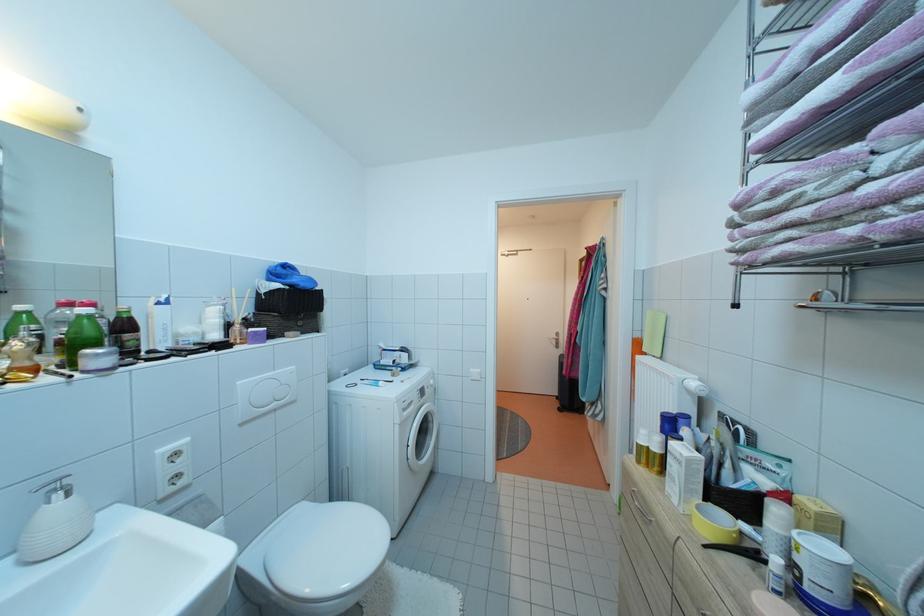
The height and width of the screenshot is (616, 924). Find the location of `green glass bottle`. green glass bottle is located at coordinates (81, 333).